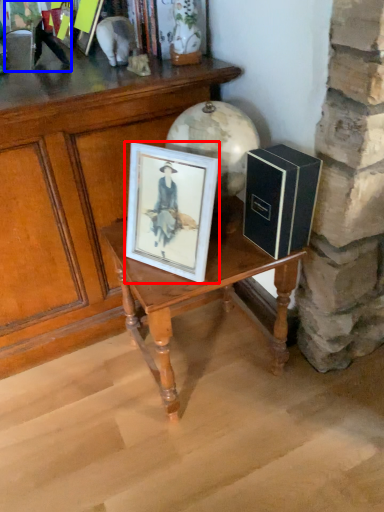
Question: Among these objects, which one is nearest to the camera, picture frame (highlighted by a red box) or couple (highlighted by a blue box)?

Choices:
 (A) picture frame
 (B) couple

Answer: (A)